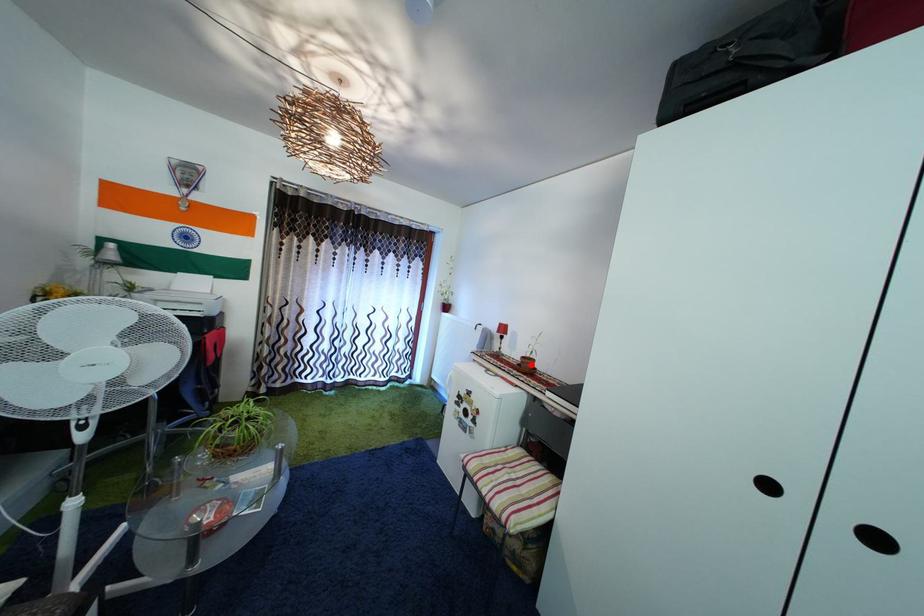
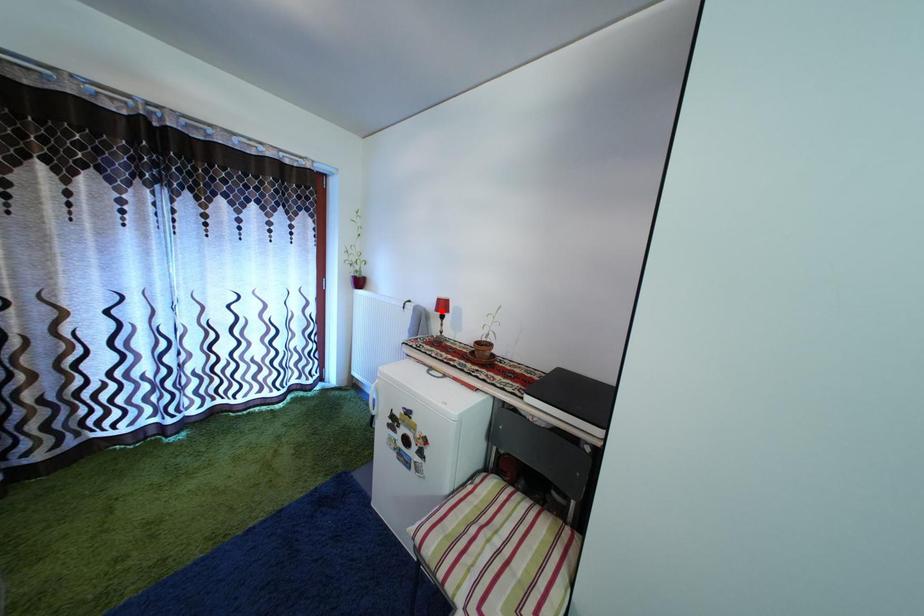
I am providing you with two images of the same scene from different viewpoints. A red point is marked on the first image and another point is marked on the second image. Is the red point in image1 aligned with the point shown in image2?

No